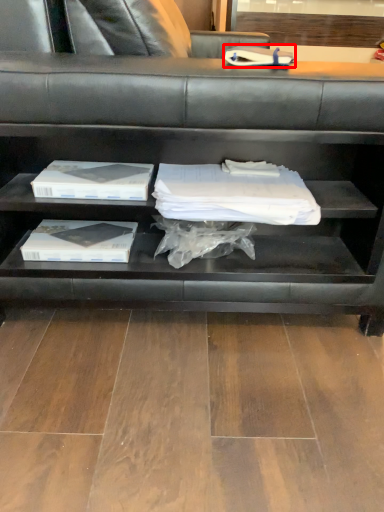
Question: From the image's perspective, considering the relative positions of book (annotated by the red box) and shelf in the image provided, where is book (annotated by the red box) located with respect to the staircase?

Choices:
 (A) below
 (B) above

Answer: (A)